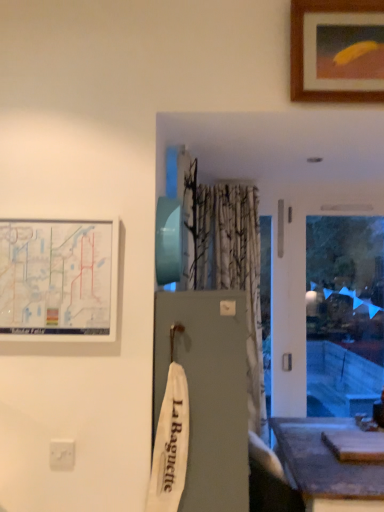
Question: Is wooden picture frame at upper right, the first picture frame viewed from the right, not close to smooth gray table at lower right?

Choices:
 (A) no
 (B) yes

Answer: (B)

Question: Considering the relative positions of wooden picture frame at upper right, which is counted as the 2th picture frame, starting from the left, and smooth gray table at lower right in the image provided, is wooden picture frame at upper right, which is counted as the 2th picture frame, starting from the left, to the right of smooth gray table at lower right from the viewer's perspective?

Choices:
 (A) no
 (B) yes

Answer: (B)

Question: Is wooden picture frame at upper right, marked as the first picture frame in a top-to-bottom arrangement, to the left of smooth gray table at lower right from the viewer's perspective?

Choices:
 (A) yes
 (B) no

Answer: (B)

Question: From the image's perspective, is wooden picture frame at upper right, which is the 2th picture frame from bottom to top, below smooth gray table at lower right?

Choices:
 (A) yes
 (B) no

Answer: (B)

Question: Does wooden picture frame at upper right, which is counted as the 2th picture frame, starting from the left, come in front of smooth gray table at lower right?

Choices:
 (A) no
 (B) yes

Answer: (B)

Question: Is point [56, 247] positioned closer to the camera than point [372, 494]?

Choices:
 (A) closer
 (B) farther

Answer: (A)

Question: Would you say white matte map at upper left, marked as the 1th picture frame in a bottom-to-top arrangement, is to the left or to the right of smooth gray table at lower right in the picture?

Choices:
 (A) right
 (B) left

Answer: (B)

Question: Is white matte map at upper left, which is counted as the 2th picture frame, starting from the top, situated inside smooth gray table at lower right or outside?

Choices:
 (A) outside
 (B) inside

Answer: (A)

Question: Is white matte map at upper left, which is counted as the 2th picture frame, starting from the top, taller or shorter than smooth gray table at lower right?

Choices:
 (A) short
 (B) tall

Answer: (A)

Question: Considering the positions of wooden picture frame at upper right, the first picture frame viewed from the right, and white plastic electric outlet at lower left in the image, is wooden picture frame at upper right, the first picture frame viewed from the right, bigger or smaller than white plastic electric outlet at lower left?

Choices:
 (A) big
 (B) small

Answer: (A)

Question: From their relative heights in the image, would you say wooden picture frame at upper right, which is counted as the 2th picture frame, starting from the left, is taller or shorter than white plastic electric outlet at lower left?

Choices:
 (A) tall
 (B) short

Answer: (A)

Question: Considering their positions, is wooden picture frame at upper right, which is counted as the 2th picture frame, starting from the left, located in front of or behind white plastic electric outlet at lower left?

Choices:
 (A) behind
 (B) front

Answer: (A)

Question: From the image's perspective, is wooden picture frame at upper right, which is counted as the 2th picture frame, starting from the left, located above or below white plastic electric outlet at lower left?

Choices:
 (A) below
 (B) above

Answer: (B)

Question: Looking at the image, does white plastic electric outlet at lower left seem bigger or smaller compared to white matte map at upper left, positioned as the second picture frame in right-to-left order?

Choices:
 (A) small
 (B) big

Answer: (A)

Question: Looking at their shapes, would you say white plastic electric outlet at lower left is wider or thinner than white matte map at upper left, placed as the 1th picture frame when sorted from left to right?

Choices:
 (A) thin
 (B) wide

Answer: (A)